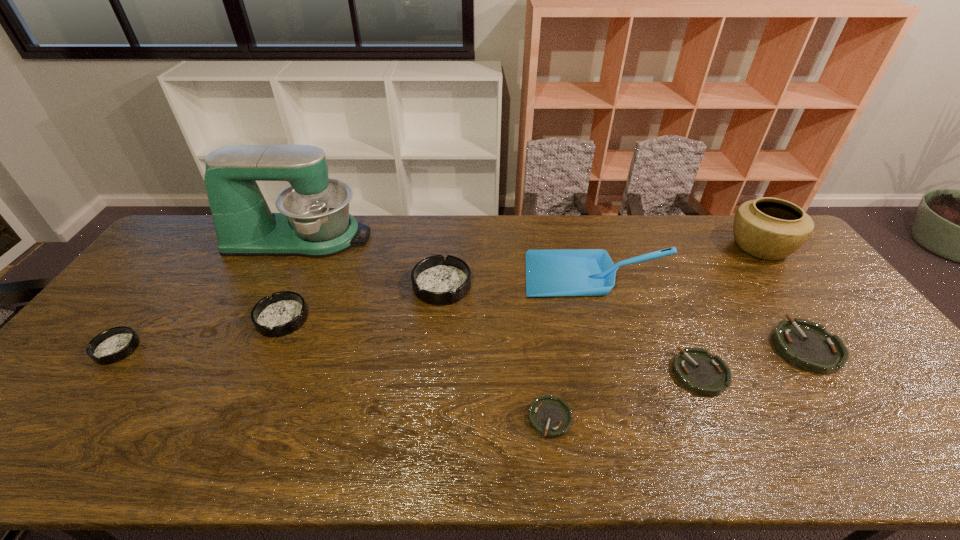
Find the location of `ashtray located at the right edge`. ashtray located at the right edge is located at coordinates [807, 345].

The width and height of the screenshot is (960, 540). Identify the location of object present at the far right corner. (768, 228).

In the image, there is a desktop. Identify the location of vacant space at the far edge. (485, 233).

Find the location of a particular element. vacant region at the near edge of the desktop is located at coordinates (415, 461).

At what (x,y) coordinates should I click in order to perform the action: click on vacant region at the left edge of the desktop. Please return your answer as a coordinate pair (x, y). This screenshot has height=540, width=960. Looking at the image, I should click on (180, 282).

The image size is (960, 540). I want to click on vacant region at the far left corner of the desktop, so click(168, 247).

Locate an element on the screen. The image size is (960, 540). free space between the mixer and the second dark ashtray from right to left is located at coordinates (291, 278).

The image size is (960, 540). What are the coordinates of `free space that is in between the rightmost green ashtray and the fifth shortest object` in the screenshot? It's located at (543, 333).

Locate an element on the screen. blank region between the mixer and the leftmost green ashtray is located at coordinates (425, 328).

I want to click on vacant space that's between the second smallest green ashtray and the biggest dark ashtray, so click(x=571, y=329).